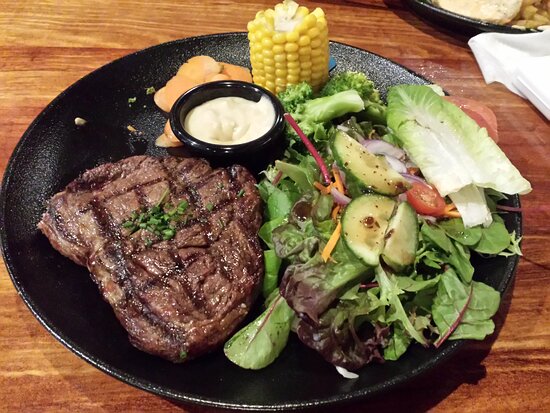
In order to click on black salad bowl in this screenshot , I will do `click(79, 137)`.